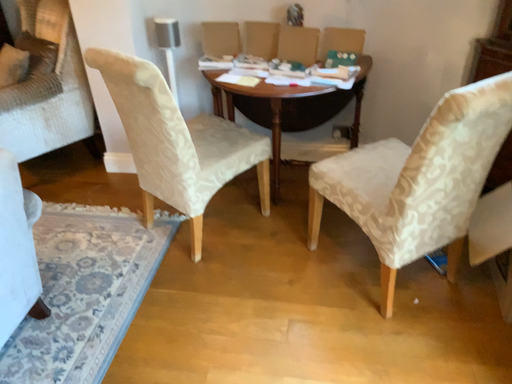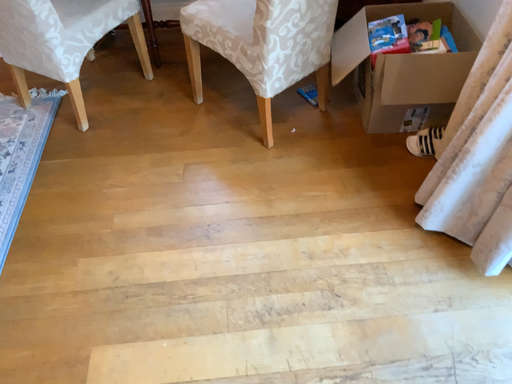
Question: How did the camera likely rotate when shooting the video?

Choices:
 (A) rotated right
 (B) rotated left

Answer: (A)